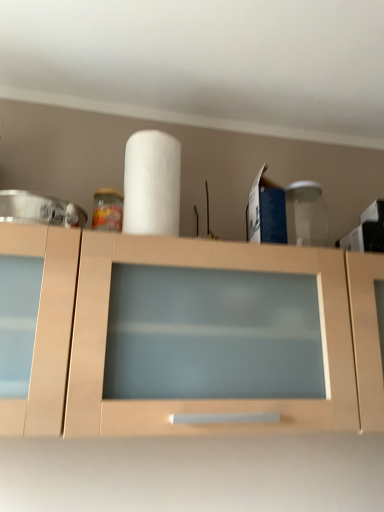
Question: Is matte wood cabinet at center in front of or behind white matte paper towel at center in the image?

Choices:
 (A) behind
 (B) front

Answer: (B)

Question: Considering the positions of matte wood cabinet at center and white matte paper towel at center in the image, is matte wood cabinet at center taller or shorter than white matte paper towel at center?

Choices:
 (A) tall
 (B) short

Answer: (A)

Question: Does point (279, 273) appear closer or farther from the camera than point (177, 184)?

Choices:
 (A) farther
 (B) closer

Answer: (B)

Question: Is white matte paper towel at center in front of or behind matte wood cabinet at center in the image?

Choices:
 (A) front
 (B) behind

Answer: (B)

Question: From the image's perspective, is white matte paper towel at center located above or below matte wood cabinet at center?

Choices:
 (A) below
 (B) above

Answer: (B)

Question: Is white matte paper towel at center inside the boundaries of matte wood cabinet at center, or outside?

Choices:
 (A) outside
 (B) inside

Answer: (A)

Question: From a real-world perspective, relative to matte wood cabinet at center, is white matte paper towel at center vertically above or below?

Choices:
 (A) below
 (B) above

Answer: (B)